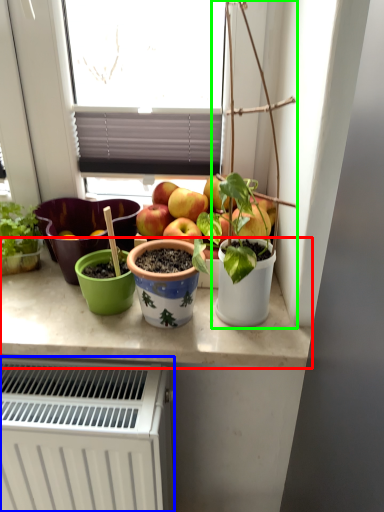
Question: Which object is the farthest from counter top (highlighted by a red box)? Choose among these: radiator (highlighted by a blue box) or houseplant (highlighted by a green box).

Choices:
 (A) radiator
 (B) houseplant

Answer: (B)